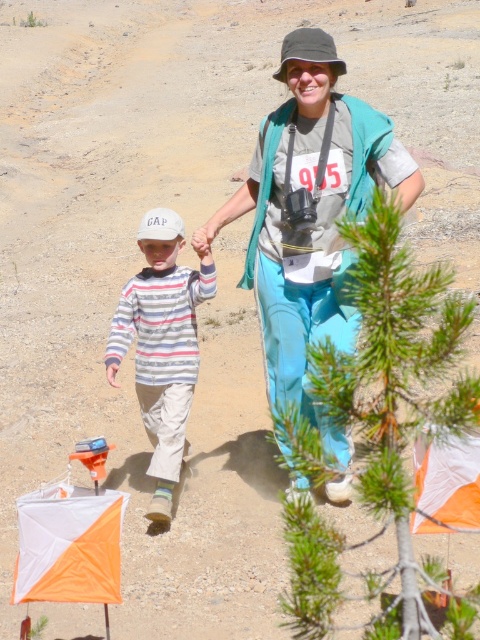
Question: Does striped cotton shirt at center appear under orange fabric kite at lower right?

Choices:
 (A) yes
 (B) no

Answer: (B)

Question: Where is striped cotton shirt at center located in relation to orange fabric kite at lower left in the image?

Choices:
 (A) below
 (B) above

Answer: (B)

Question: Can you confirm if green needle-like pine at center is positioned above matte gray hat at center?

Choices:
 (A) yes
 (B) no

Answer: (B)

Question: Which of the following is the closest to the observer?

Choices:
 (A) orange fabric kite at lower left
 (B) striped cotton shirt at center

Answer: (A)

Question: Which object is closer to the camera taking this photo?

Choices:
 (A) green needle-like pine at center
 (B) striped cotton shirt at center
 (C) orange fabric kite at lower right

Answer: (A)

Question: Which point is closer to the camera?

Choices:
 (A) (369, 189)
 (B) (429, 529)
 (C) (64, 531)

Answer: (C)